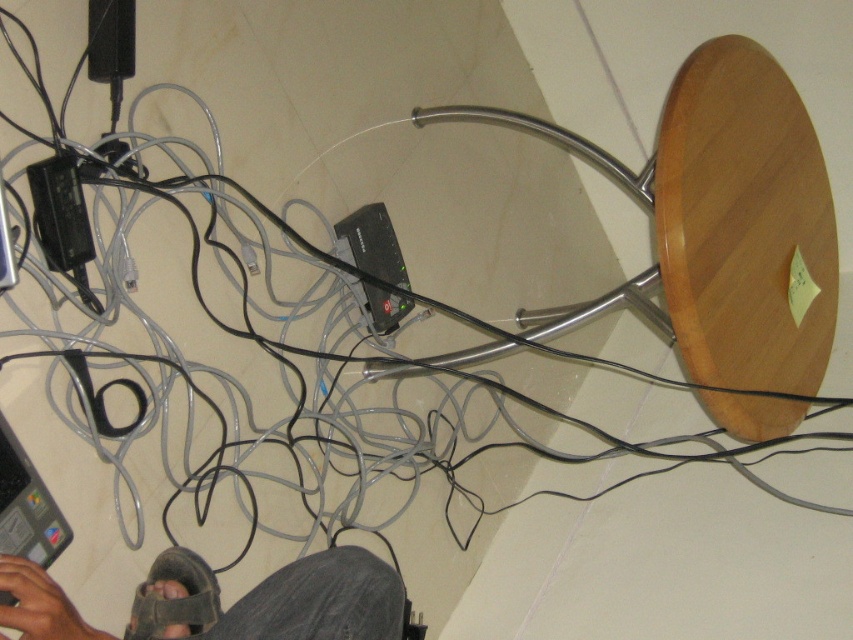
Question: Is brown leather sandal at lower left positioned behind black plastic router at center?

Choices:
 (A) yes
 (B) no

Answer: (B)

Question: Is the position of gray fabric pants at lower center more distant than that of brown leather sandal at lower left?

Choices:
 (A) no
 (B) yes

Answer: (A)

Question: Which point appears closest to the camera in this image?

Choices:
 (A) (370, 308)
 (B) (65, 209)

Answer: (B)

Question: Which of the following is the farthest from the observer?

Choices:
 (A) (396, 609)
 (B) (74, 237)

Answer: (B)

Question: Is gray fabric pants at lower center positioned before black plastic plug at lower left?

Choices:
 (A) no
 (B) yes

Answer: (B)

Question: Estimate the real-world distances between objects in this image. Which object is closer to the gray fabric pants at lower center?

Choices:
 (A) brown leather sandal at lower left
 (B) black plastic plug at lower left

Answer: (A)